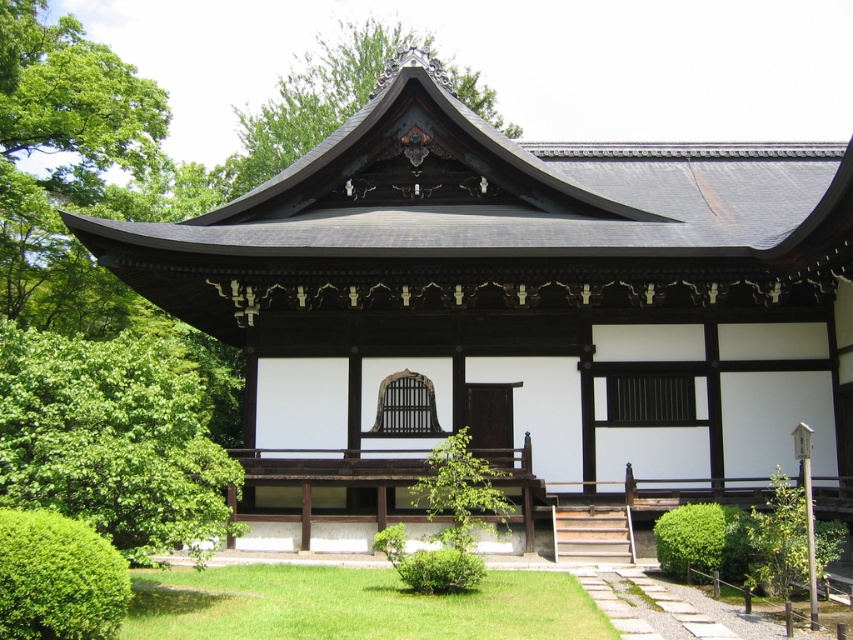
Who is taller, green leafy tree at lower left or green leafy tree at upper center?

Standing taller between the two is green leafy tree at upper center.

Is green leafy tree at lower left smaller than green leafy tree at upper center?

Yes, green leafy tree at lower left is smaller than green leafy tree at upper center.

Between point (195, 483) and point (247, 118), which one is positioned behind?

The point (247, 118) is more distant.

This screenshot has height=640, width=853. Find the location of `green leafy tree at lower left`. green leafy tree at lower left is located at coordinates (111, 440).